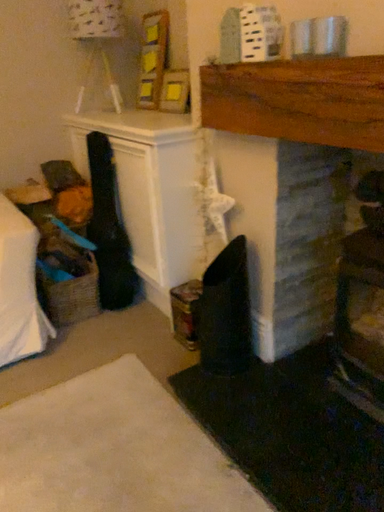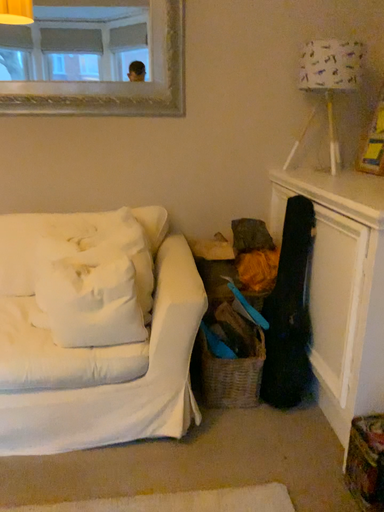
Question: Which way did the camera rotate in the video?

Choices:
 (A) rotated left
 (B) rotated right

Answer: (A)